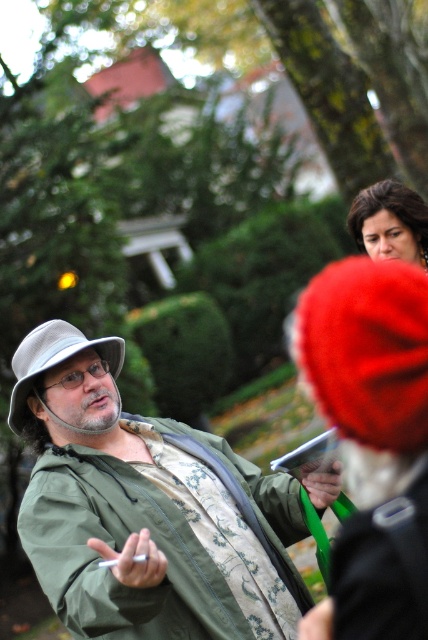
Question: Which is nearer to the green matte jacket at center?

Choices:
 (A) red fuzzy christmas hat at upper right
 (B) gray fabric hat at left

Answer: (B)

Question: Is green matte jacket at center in front of gray fabric hat at left?

Choices:
 (A) yes
 (B) no

Answer: (A)

Question: Is red fuzzy christmas hat at upper right closer to the viewer compared to gray fabric hat at left?

Choices:
 (A) no
 (B) yes

Answer: (B)

Question: Can you confirm if red fuzzy christmas hat at upper right is positioned above gray fabric hat at left?

Choices:
 (A) yes
 (B) no

Answer: (A)

Question: Among these objects, which one is nearest to the camera?

Choices:
 (A) red fuzzy christmas hat at upper right
 (B) gray fabric hat at left
 (C) green matte jacket at center

Answer: (A)

Question: Based on their relative distances, which object is farther from the gray fabric hat at left?

Choices:
 (A) green matte jacket at center
 (B) red fuzzy christmas hat at upper right

Answer: (B)